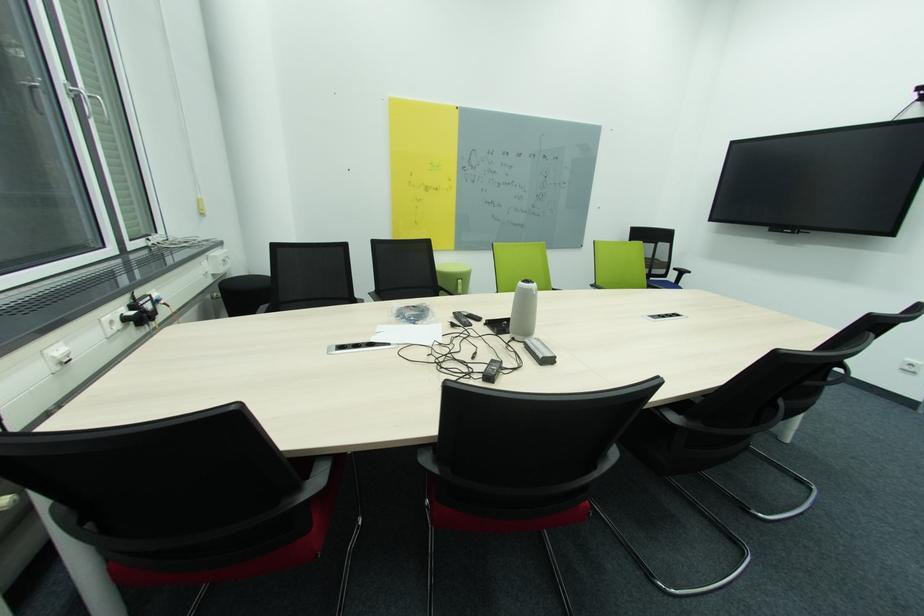
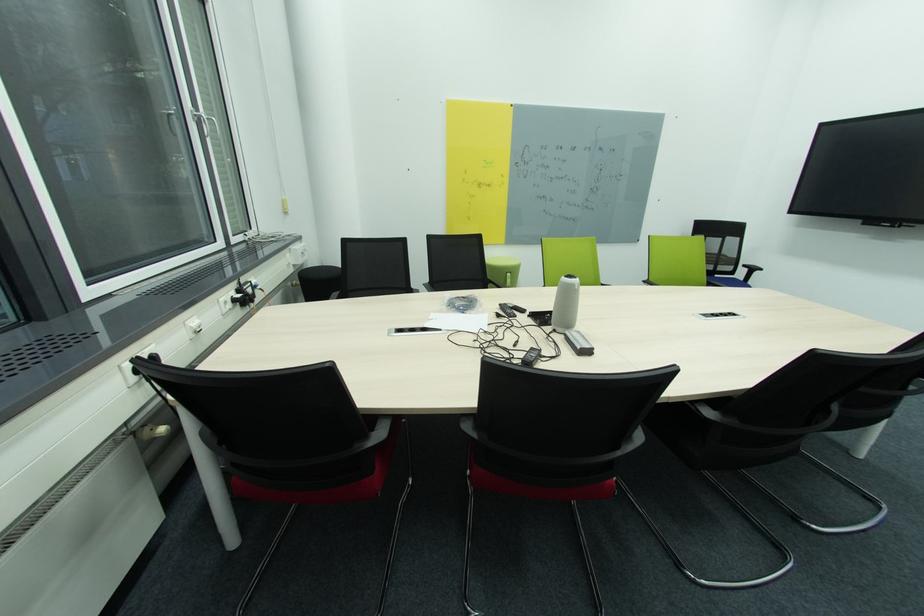
In the second image, find the point that corresponds to pixel 394 323 in the first image.

(444, 313)